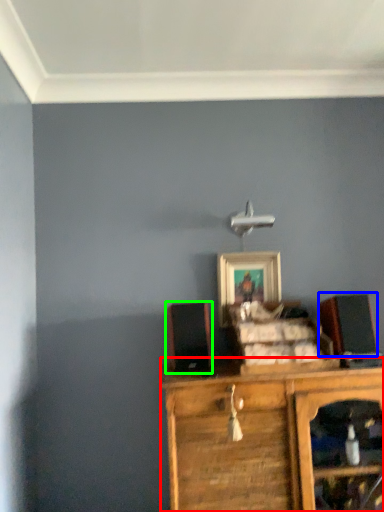
Question: Which object is the closest to the chest of drawers (highlighted by a red box)? Choose among these: speaker (highlighted by a blue box) or speaker (highlighted by a green box).

Choices:
 (A) speaker
 (B) speaker

Answer: (B)